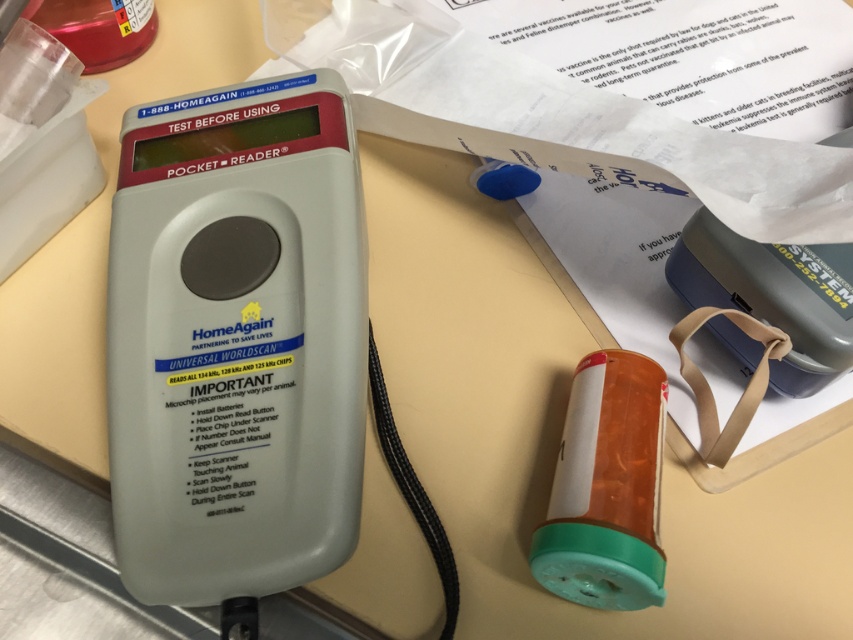
Can you confirm if white plastic pocket reader at center is positioned to the left of translucent plastic bottle at upper left?

No, white plastic pocket reader at center is not to the left of translucent plastic bottle at upper left.

Which is in front, point (271, 88) or point (74, 29)?

Positioned in front is point (271, 88).

Locate an element on the screen. The width and height of the screenshot is (853, 640). white plastic pocket reader at center is located at coordinates (236, 342).

Based on the photo, between translucent plastic pill bottle at center and translucent plastic bottle at upper left, which one is positioned lower?

translucent plastic pill bottle at center

Describe the element at coordinates (607, 486) in the screenshot. Image resolution: width=853 pixels, height=640 pixels. I see `translucent plastic pill bottle at center` at that location.

Locate an element on the screen. This screenshot has height=640, width=853. translucent plastic pill bottle at center is located at coordinates (607, 486).

Is white plastic pocket reader at center positioned in front of translucent plastic pill bottle at center?

No, white plastic pocket reader at center is behind translucent plastic pill bottle at center.

Is the position of white plastic pocket reader at center more distant than that of translucent plastic pill bottle at center?

Yes.

Is point (265, 161) in front of point (636, 429)?

No, (265, 161) is behind (636, 429).

Locate an element on the screen. Image resolution: width=853 pixels, height=640 pixels. white plastic pocket reader at center is located at coordinates (236, 342).